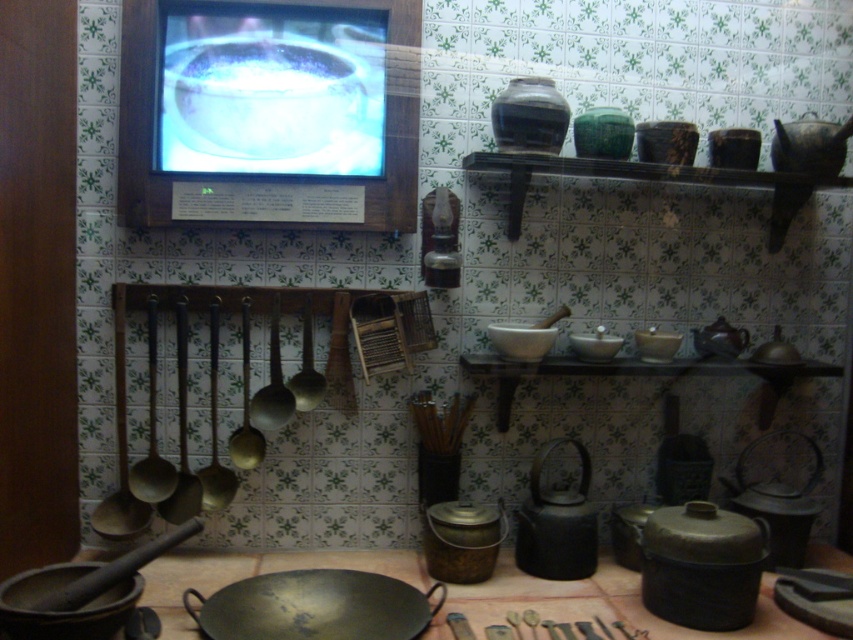
You are a museum visitor who wants to place a 16 inch long decorative plate between the matte black kettle at center and the matte black tea pot at lower right. Is there enough space?

The distance between the matte black kettle at center and the matte black tea pot at lower right is 17.10 inches. Since the decorative plate is 16 inches long, there is enough space to place it between them.

You are a museum visitor who wants to take a photo of the matte black kettle at center and the matte black tea pot at lower right. Which object is positioned lower in the image?

The matte black kettle at center is positioned below the matte black tea pot at lower right, so the kettle is lower.

Please describe the position of the dark brown wood at lower center in the kitchen exhibit using coordinates from a 2D grid where the bottom left corner is the origin point. The grid has a maximum value of 1 on both the x and y axes. Please provide the coordinates as a pair in parentheses, like this example format without any explanation or extra text. The answer should be exactly in the format of the example given. For instance, if the coordinates were 0.5 and 0.5, you would write exactly this without any

The coordinates of the dark brown wood at lower center are exactly at point (x=596, y=604). Therefore, the answer is the pair in parentheses as requested.